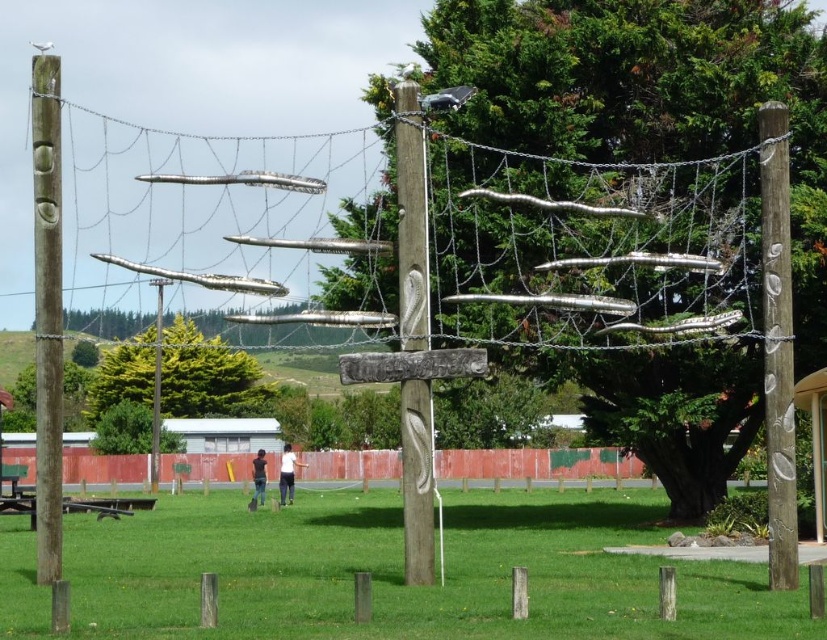
Is white cotton shirt at center smaller than dark blue jeans at center?

Yes.

Does white cotton shirt at center have a larger size compared to dark blue jeans at center?

Incorrect, white cotton shirt at center is not larger than dark blue jeans at center.

This screenshot has height=640, width=827. I want to click on white cotton shirt at center, so click(x=287, y=474).

Between green wood tree at center and brown wooden post at center, which one is positioned higher?

green wood tree at center is above.

What do you see at coordinates (646, 93) in the screenshot?
I see `green wood tree at center` at bounding box center [646, 93].

What are the coordinates of `green wood tree at center` in the screenshot? It's located at (646, 93).

Is brown wooden post at center positioned behind dark blue jeans at center?

Yes.

Which is more to the right, brown wooden post at center or dark blue jeans at center?

dark blue jeans at center is more to the right.

Between point (156, 323) and point (252, 461), which one is positioned behind?

Point (156, 323)

You are a GUI agent. You are given a task and a screenshot of the screen. Output one action in this format:
    pyautogui.click(x=<x>, y=<y>)
    Task: Click on the brown wooden post at center
    The height and width of the screenshot is (640, 827).
    Given the screenshot: What is the action you would take?
    pyautogui.click(x=156, y=384)